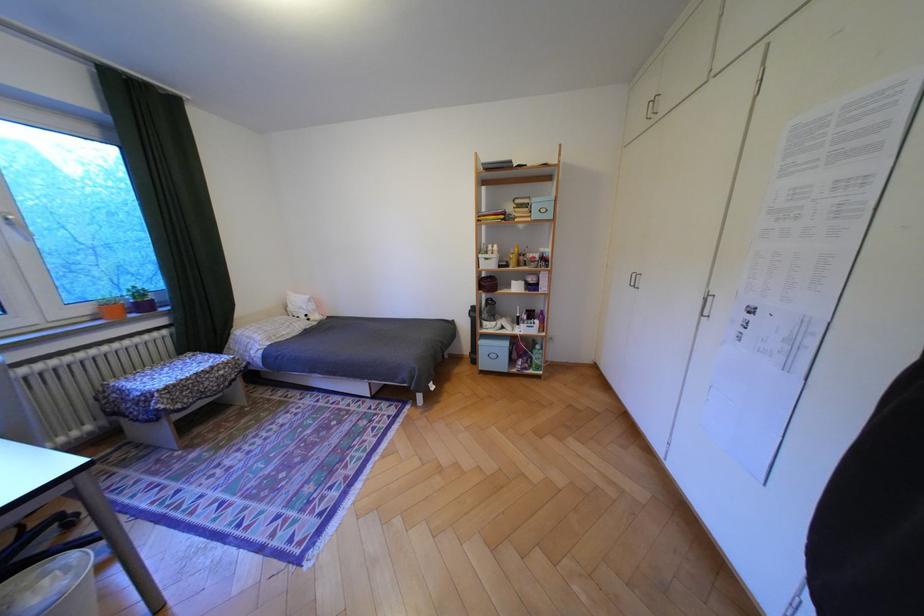
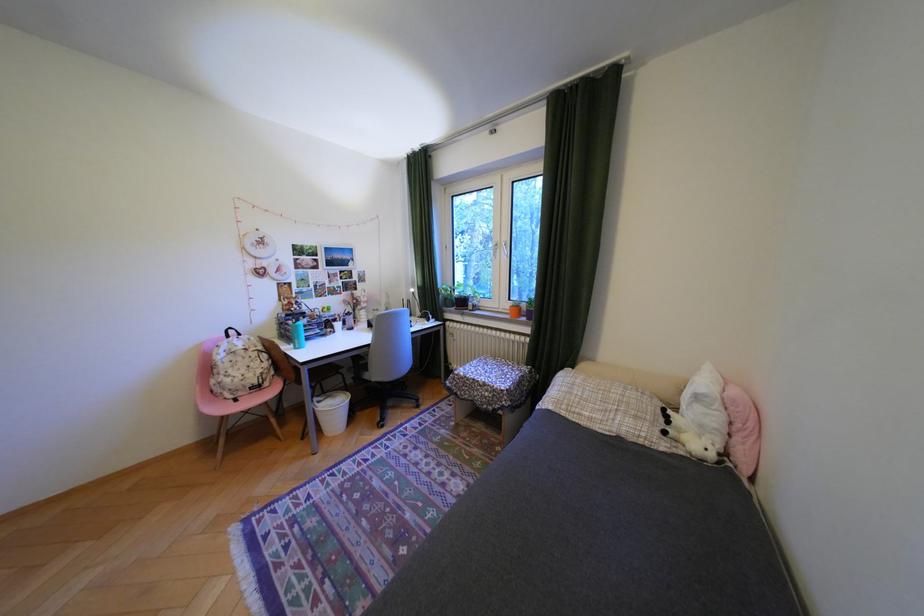
Locate, in the second image, the point that corresponds to (x=321, y=320) in the first image.

(676, 432)